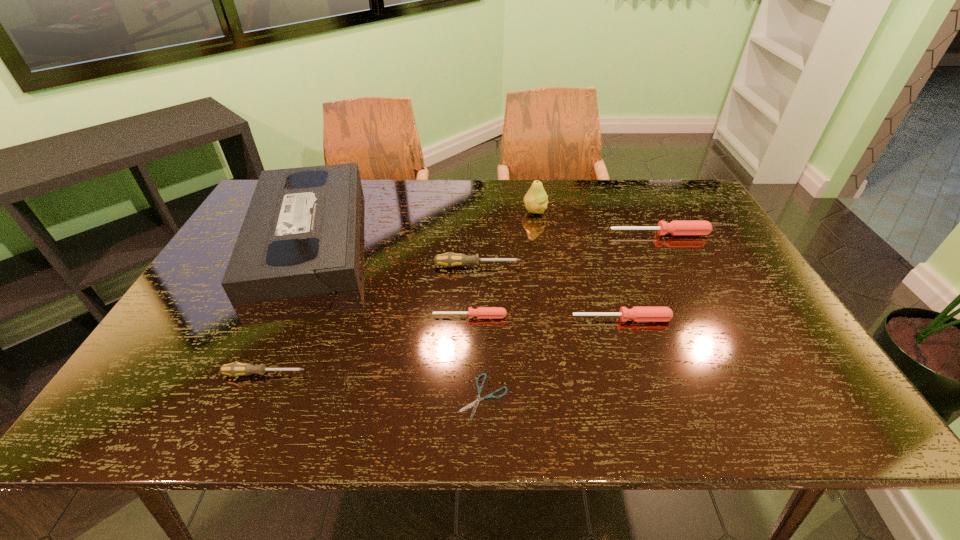
Find the location of `empty space that is in between the black shears and the tallest object`. empty space that is in between the black shears and the tallest object is located at coordinates (509, 304).

Locate an element on the screen. Image resolution: width=960 pixels, height=540 pixels. vacant point located between the biggest red screwdriver and the second tallest object is located at coordinates point(484,234).

Where is `object that is the closest one to the black shears`? The image size is (960, 540). object that is the closest one to the black shears is located at coordinates (481, 312).

This screenshot has width=960, height=540. I want to click on the fourth closest object to the bigger gray screwdriver, so click(x=536, y=200).

The width and height of the screenshot is (960, 540). Identify the location of the closest screwdriver to the bigger gray screwdriver. (481, 312).

Identify which screwdriver is located as the nearest to the smaller gray screwdriver. Please provide its 2D coordinates. Your answer should be formatted as a tuple, i.e. [(x, y)], where the tuple contains the x and y coordinates of a point satisfying the conditions above.

[(481, 312)]

This screenshot has width=960, height=540. What are the coordinates of `red screwdriver that is the third nearest to the pear` in the screenshot? It's located at (481, 312).

Identify which red screwdriver is located as the nearest to the videotape. Please provide its 2D coordinates. Your answer should be formatted as a tuple, i.e. [(x, y)], where the tuple contains the x and y coordinates of a point satisfying the conditions above.

[(481, 312)]

This screenshot has height=540, width=960. Identify the location of free space that satisfies the following two spatial constraints: 1. at the tip of the black shears; 2. on the right side of the smaller gray screwdriver. (254, 397).

The image size is (960, 540). I want to click on vacant region that satisfies the following two spatial constraints: 1. on the front side of the second biggest red screwdriver; 2. at the tip of the leftmost screwdriver, so click(x=639, y=374).